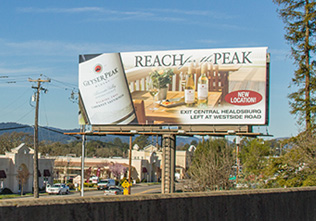
The width and height of the screenshot is (316, 221). I want to click on bottle of wine, so click(109, 87), click(189, 91), click(204, 90).